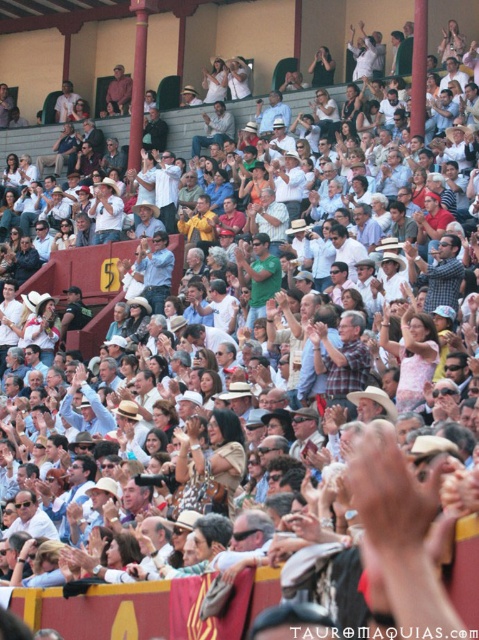
Who is more distant from viewer, (148, 272) or (107, 108)?

Point (107, 108)

Does matte blue shirt at center appear on the right side of matte brown shirt at upper center?

Correct, you'll find matte blue shirt at center to the right of matte brown shirt at upper center.

Is point (159, 300) positioned after point (105, 97)?

No, it is not.

Find the location of a particular element. matte blue shirt at center is located at coordinates (155, 269).

Is matte white shirt at center to the left of matte brown shirt at upper center from the viewer's perspective?

Incorrect, matte white shirt at center is not on the left side of matte brown shirt at upper center.

Is the position of matte white shirt at center more distant than that of matte brown shirt at upper center?

That is False.

This screenshot has width=479, height=640. I want to click on matte white shirt at center, so click(214, 129).

At what (x,y) coordinates should I click in order to perform the action: click on matte white shirt at center. Please return your answer as a coordinate pair (x, y). Looking at the image, I should click on [214, 129].

At what (x,y) coordinates should I click in order to perform the action: click on matte blue shirt at center. Please return your answer as a coordinate pair (x, y). The image size is (479, 640). Looking at the image, I should click on (155, 269).

Locate an element on the screen. The image size is (479, 640). matte blue shirt at center is located at coordinates (155, 269).

At what (x,y) coordinates should I click in order to perform the action: click on matte blue shirt at center. Please return your answer as a coordinate pair (x, y). The width and height of the screenshot is (479, 640). Looking at the image, I should click on (155, 269).